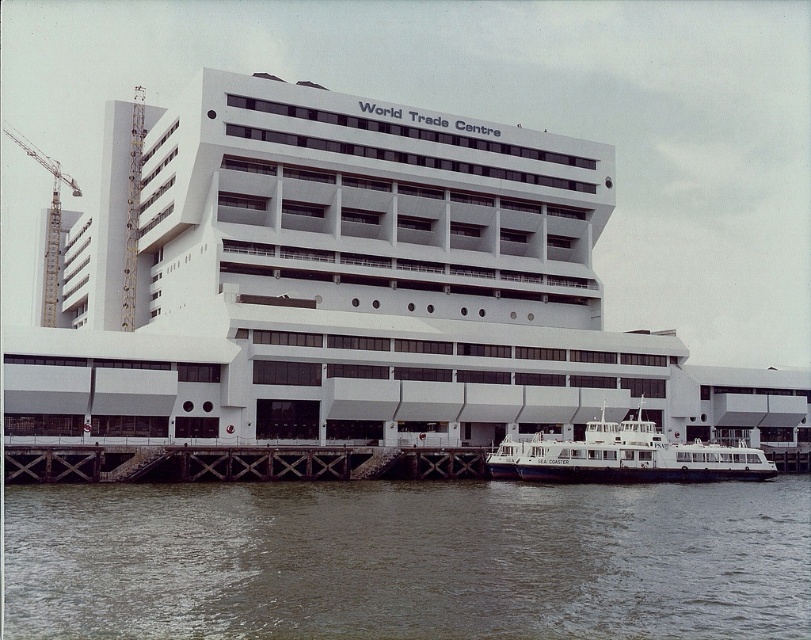
Looking at this image, you are a construction worker standing on the dock near the brown murky water at lower center. You need to move a heavy beam to the metallic construction crane at left. Given that your carrying capacity allows you to move objects up to 300 feet, can you safely transport the beam to the crane without exceeding your limit?

The distance between the brown murky water at lower center and the metallic construction crane at left is 347.03 feet. Since this exceeds your carrying capacity of 300 feet, you cannot safely transport the beam to the crane without exceeding your limit.

You are a photographer planning to capture the World Trade Centre from the dock where the ferry is moored. You want to ensure that both the brown murky water at lower center and the metallic construction crane at left are visible in your shot. Based on their relative heights, which object will appear larger in the photo?

The metallic construction crane at left will appear larger in the photo because it is taller than the brown murky water at lower center.

You are a passenger on the white matte cruise ship at lower right and want to disembark at the dock near the brown murky water at lower center. Based on the scene, can you walk directly to the dock from your current position on the ship?

The white matte cruise ship at lower right is positioned on the left side of brown murky water at lower center, so you can walk directly to the dock from your current position on the ship.